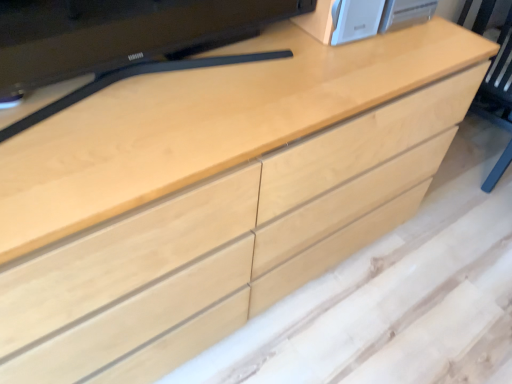
Locate an element on the screen. light wood armchair at right is located at coordinates (498, 84).

The height and width of the screenshot is (384, 512). Describe the element at coordinates (498, 84) in the screenshot. I see `light wood armchair at right` at that location.

The width and height of the screenshot is (512, 384). What are the coordinates of `light wood armchair at right` in the screenshot? It's located at (498, 84).